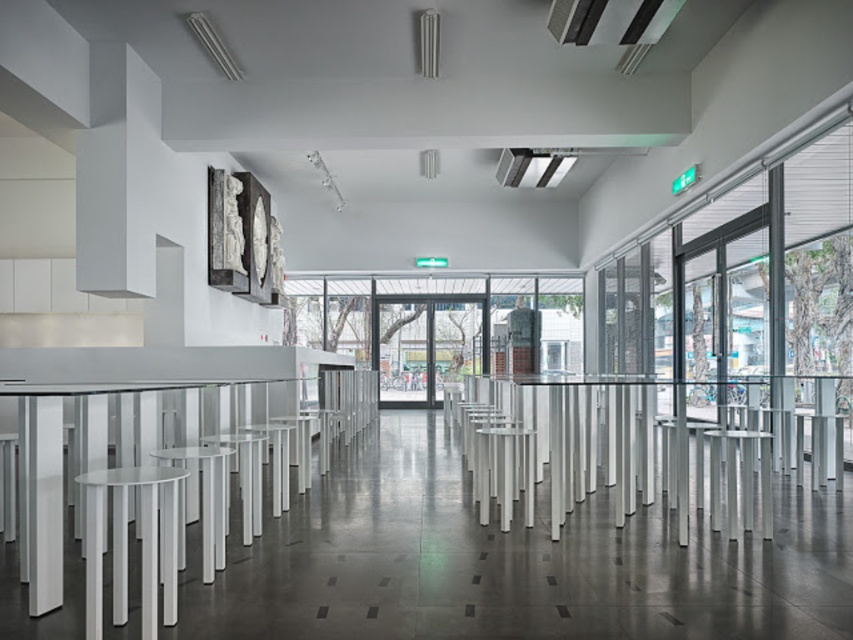
Question: Can you confirm if white glossy table at left is positioned above white plastic bar stool at lower left?

Choices:
 (A) yes
 (B) no

Answer: (A)

Question: Which point appears closest to the camera in this image?

Choices:
 (A) (202, 497)
 (B) (51, 580)

Answer: (B)

Question: Is white glossy table at left thinner than white plastic bar stool at lower left?

Choices:
 (A) no
 (B) yes

Answer: (A)

Question: Which of the following is the closest to the observer?

Choices:
 (A) (187, 458)
 (B) (45, 410)

Answer: (B)

Question: Does white glossy table at left have a greater width compared to white plastic bar stool at lower left?

Choices:
 (A) no
 (B) yes

Answer: (B)